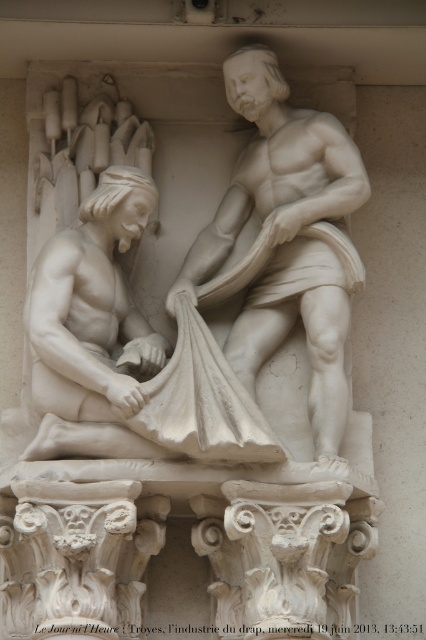
Is white marble man at left above white marble statue at center?

Incorrect, white marble man at left is not positioned above white marble statue at center.

Does point (103, 420) lie in front of point (239, 113)?

Yes.

Image resolution: width=426 pixels, height=640 pixels. What are the coordinates of `white marble man at left` in the screenshot? It's located at (129, 349).